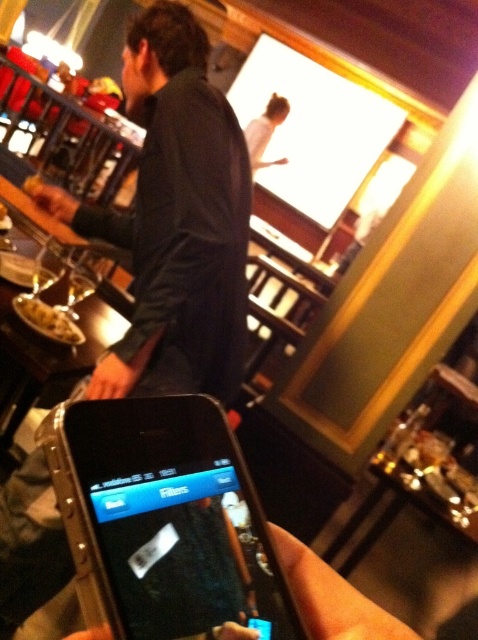
You are holding a black plastic smartphone at lower center and a matte black hand at center. Which object is larger?

The matte black hand at center is larger than the black plastic smartphone at lower center.

You are at a bar and want to check your phone for a filter. The phone is at point (169,520). Is the phone in the lower center of the image?

Yes, the phone is at point (169,520), which is in the lower center of the image according to the provided coordinates.

You are a photographer trying to capture the scene in the image. The black plastic smartphone at lower center is blocking your view of the person at the counter. To avoid the smartphone, should you move to the left or right?

To avoid the black plastic smartphone at lower center, you should move to the right since the smartphone is positioned at coordinate point 0.814 on the x axis, which is closer to the right side of the image. Moving right would shift your perspective away from the smartphone and towards the left side of the scene, allowing you to see the person at the counter without obstruction.